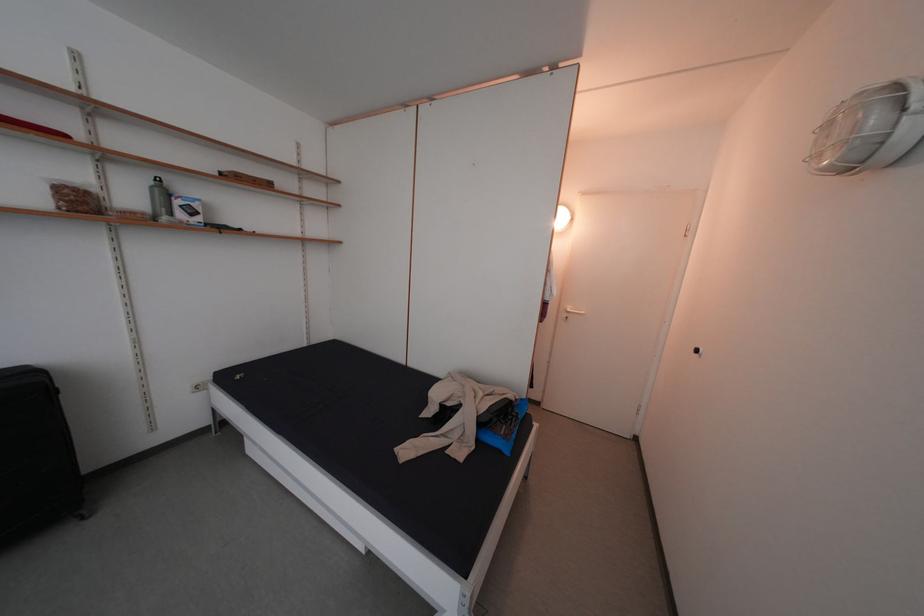
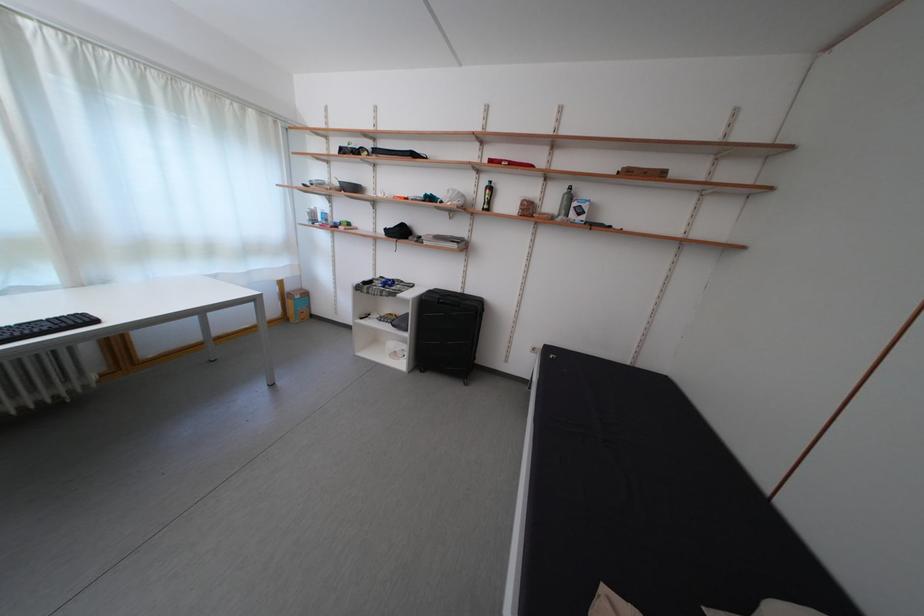
Question: The first image is from the beginning of the video and the second image is from the end. How did the camera likely rotate when shooting the video?

Choices:
 (A) Left
 (B) Right
 (C) Up
 (D) Down

Answer: (A)